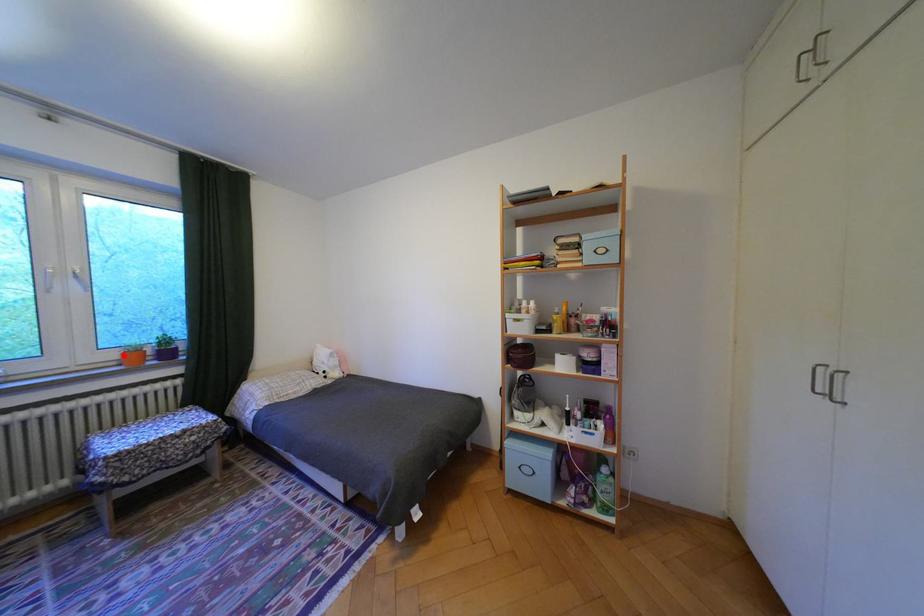
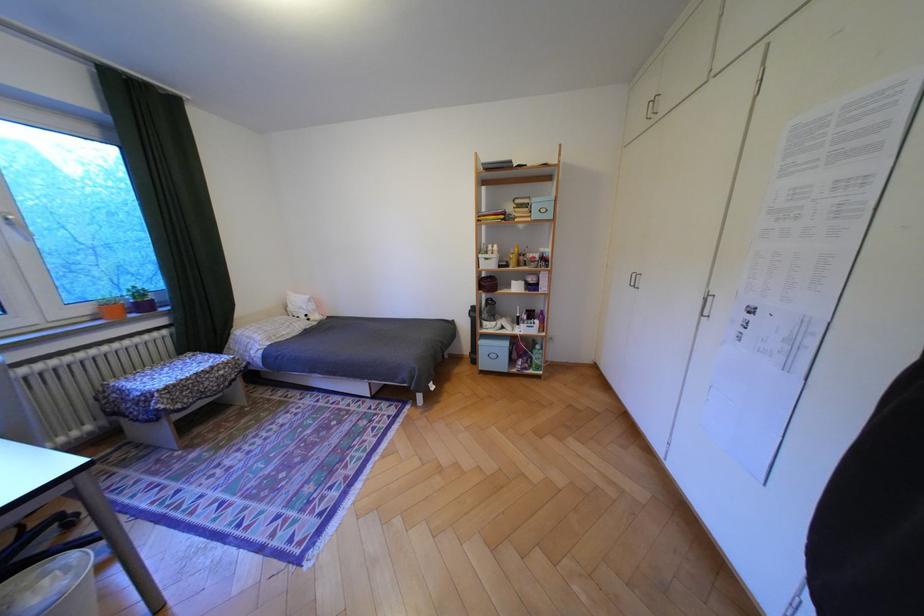
In the second image, find the point that corresponds to the highlighted location in the first image.

(99, 310)